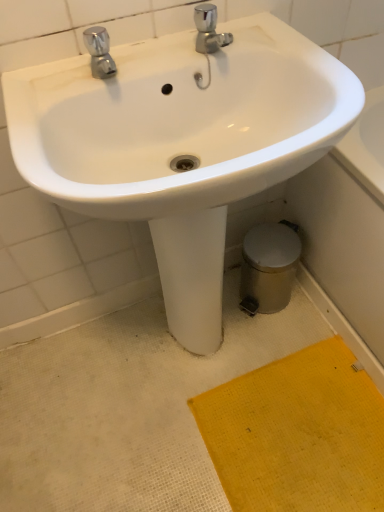
Question: From a real-world perspective, relative to yellow textured mat at lower right, is polished chrome faucet at upper left vertically above or below?

Choices:
 (A) above
 (B) below

Answer: (A)

Question: Relative to yellow textured mat at lower right, is polished chrome faucet at upper left in front or behind?

Choices:
 (A) front
 (B) behind

Answer: (A)

Question: Which object is the closest to the polished chrome faucet at upper left?

Choices:
 (A) white glossy sink at center
 (B) yellow textured mat at lower right

Answer: (A)

Question: Estimate the real-world distances between objects in this image. Which object is farther from the yellow textured mat at lower right?

Choices:
 (A) polished chrome faucet at upper left
 (B) white glossy sink at center

Answer: (A)